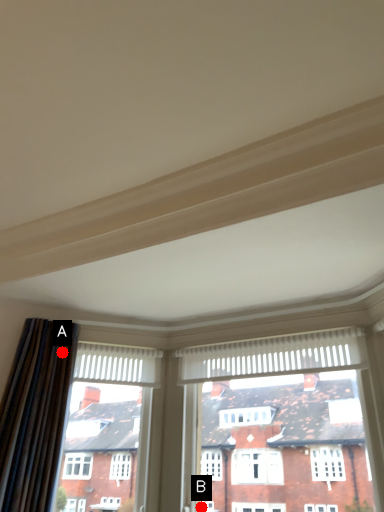
Question: Two points are circled on the image, labeled by A and B beside each circle. Which point is further to the camera?

Choices:
 (A) A is further
 (B) B is further

Answer: (A)